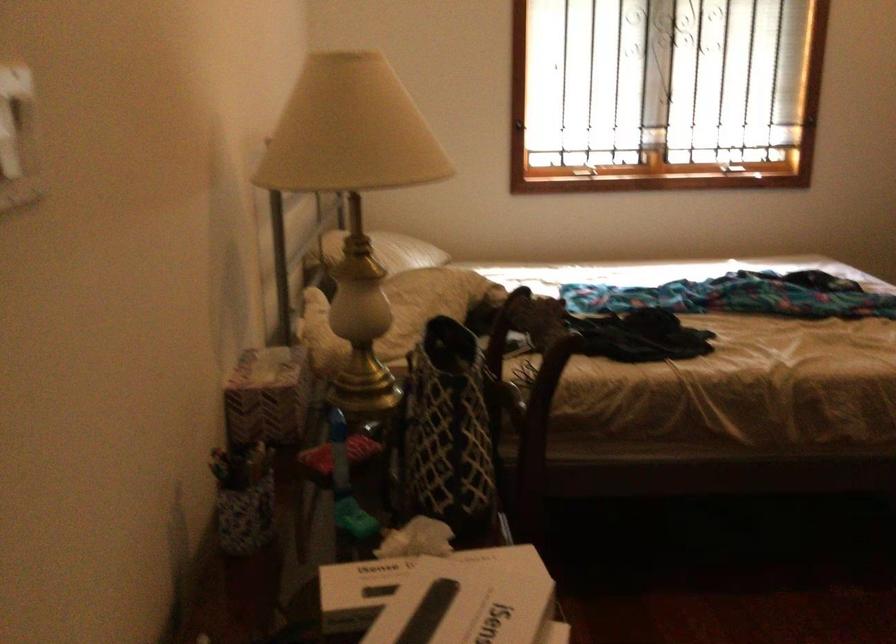
What are the coordinates of `window latch` in the screenshot? It's located at (520, 124).